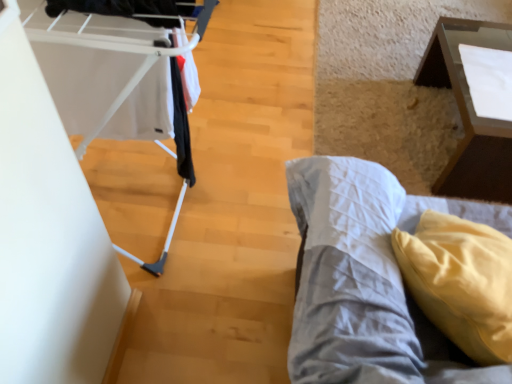
Question: Considering the positions of point (397, 284) and point (87, 19), is point (397, 284) closer or farther from the camera than point (87, 19)?

Choices:
 (A) closer
 (B) farther

Answer: (B)

Question: Looking at their shapes, would you say yellow fabric pillow at lower right is wider or thinner than white plastic baby carriage at left?

Choices:
 (A) thin
 (B) wide

Answer: (B)

Question: Based on their relative distances, which object is farther from the white plastic baby carriage at left?

Choices:
 (A) yellow fabric pillow at lower right
 (B) transparent glass table at upper right

Answer: (B)

Question: Which object is positioned closest to the transparent glass table at upper right?

Choices:
 (A) yellow fabric pillow at lower right
 (B) white plastic baby carriage at left

Answer: (A)